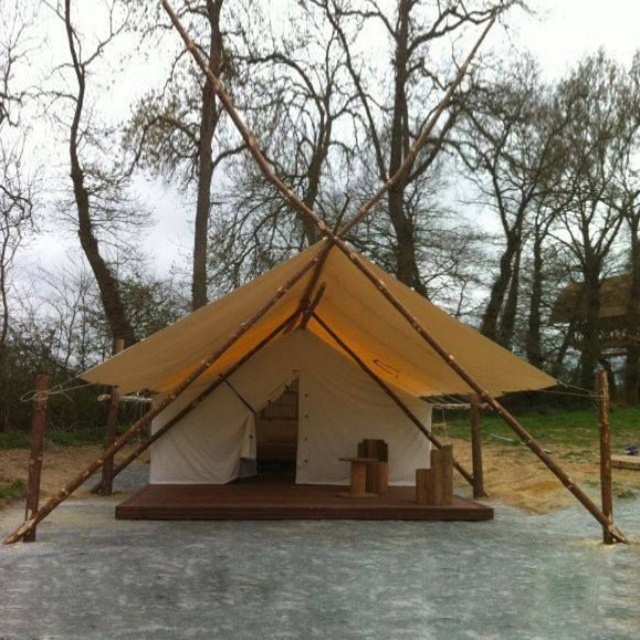
Question: Among these points, which one is farthest from the camera?

Choices:
 (A) (339, 268)
 (B) (300, 122)

Answer: (B)

Question: Can you confirm if brown wooden pole at center is wider than beige canvas tent at center?

Choices:
 (A) no
 (B) yes

Answer: (B)

Question: Is brown wooden pole at center smaller than beige canvas tent at center?

Choices:
 (A) no
 (B) yes

Answer: (A)

Question: Which of the following is the closest to the observer?

Choices:
 (A) brown wooden pole at center
 (B) beige canvas tent at center

Answer: (B)

Question: Which object is farther from the camera taking this photo?

Choices:
 (A) beige canvas tent at center
 (B) brown wooden pole at center

Answer: (B)

Question: Is brown wooden pole at center to the left of beige canvas tent at center from the viewer's perspective?

Choices:
 (A) no
 (B) yes

Answer: (A)